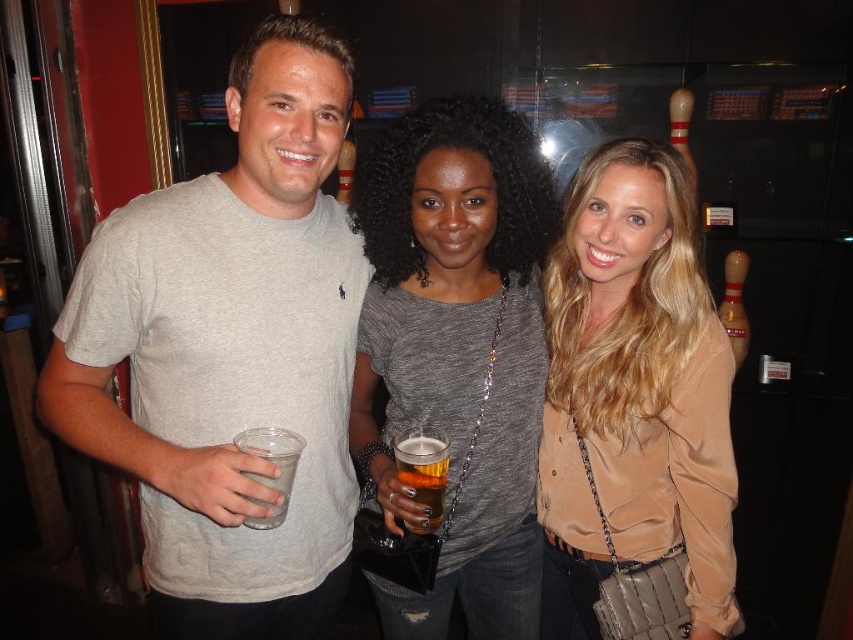
Question: Based on their relative distances, which object is farther from the translucent plastic cup at center?

Choices:
 (A) satin beige blouse at center
 (B) matte gray shirt at center
 (C) gray t-shirt at left

Answer: (A)

Question: Observing the image, what is the correct spatial positioning of gray t-shirt at left in reference to matte gray shirt at center?

Choices:
 (A) above
 (B) below

Answer: (A)

Question: Which point is closer to the camera?

Choices:
 (A) (270, 612)
 (B) (518, 150)
 (C) (434, 512)

Answer: (C)

Question: Based on their relative distances, which object is nearer to the satin beige blouse at center?

Choices:
 (A) matte gray shirt at center
 (B) translucent plastic cup at center
 (C) gray t-shirt at left

Answer: (A)

Question: Is matte gray shirt at center to the left of satin beige blouse at center from the viewer's perspective?

Choices:
 (A) no
 (B) yes

Answer: (B)

Question: Does gray t-shirt at left have a smaller size compared to satin beige blouse at center?

Choices:
 (A) no
 (B) yes

Answer: (A)